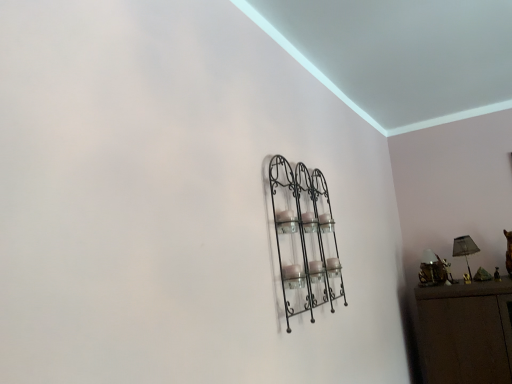
Question: Visually, is black wrought iron shelf at center positioned to the left or to the right of metallic gold lamp at right?

Choices:
 (A) left
 (B) right

Answer: (A)

Question: Considering the positions of point (328, 304) and point (426, 266), is point (328, 304) closer or farther from the camera than point (426, 266)?

Choices:
 (A) closer
 (B) farther

Answer: (A)

Question: Which object is positioned closest to the black wrought iron shelf at center?

Choices:
 (A) metallic gold lamp at right
 (B) matte black lampshade at right

Answer: (A)

Question: Which object is positioned farthest from the black wrought iron shelf at center?

Choices:
 (A) metallic gold lamp at right
 (B) matte black lampshade at right

Answer: (B)